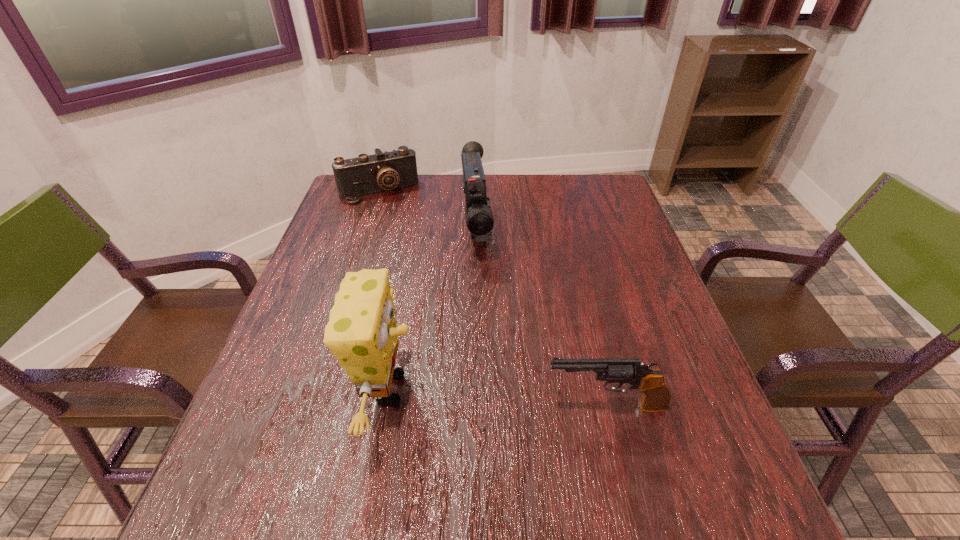
This screenshot has height=540, width=960. Identify the location of free space on the desktop that is between the sponge and the rightmost object and is positioned on the front-facing side of the camcorder. (507, 399).

At what (x,y) coordinates should I click in order to perform the action: click on vacant spot on the desktop that is between the sponge and the gun and is positioned on the front-facing side of the shortest object. Please return your answer as a coordinate pair (x, y). The image size is (960, 540). Looking at the image, I should click on (470, 396).